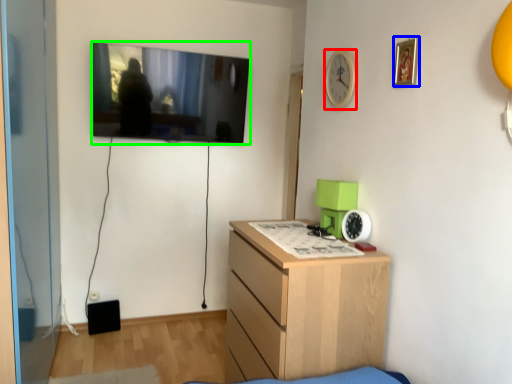
Question: Estimate the real-world distances between objects in this image. Which object is farther from clock (highlighted by a red box), picture frame (highlighted by a blue box) or television (highlighted by a green box)?

Choices:
 (A) picture frame
 (B) television

Answer: (B)